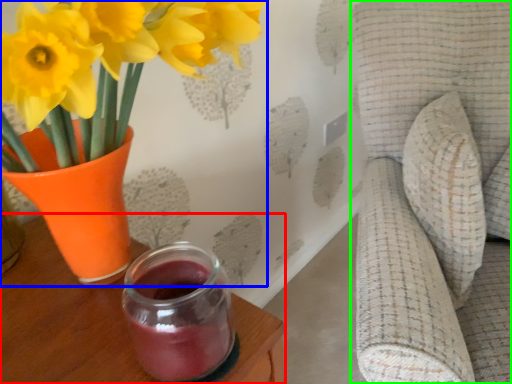
Question: Considering the real-world distances, which object is farthest from table (highlighted by a red box)? houseplant (highlighted by a blue box) or swivel chair (highlighted by a green box)?

Choices:
 (A) houseplant
 (B) swivel chair

Answer: (B)